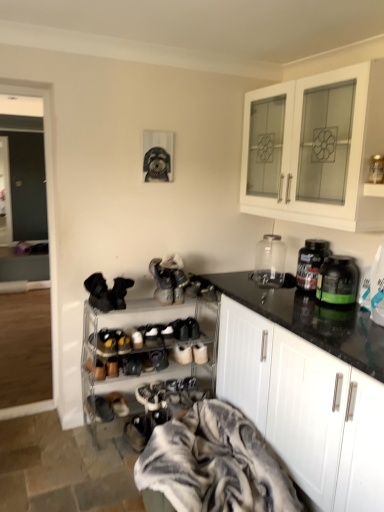
Question: Considering the positions of black suede shoes at lower center, acting as the fifth footwear starting from the top, and black matte shoe at center, which is the second shoe from top to bottom, in the image, is black suede shoes at lower center, acting as the fifth footwear starting from the top, taller or shorter than black matte shoe at center, which is the second shoe from top to bottom,?

Choices:
 (A) tall
 (B) short

Answer: (A)

Question: Is black suede shoes at lower center, acting as the fifth footwear starting from the top, in front of or behind black matte shoe at center, the 5th shoe from the bottom, in the image?

Choices:
 (A) behind
 (B) front

Answer: (B)

Question: Based on their relative distances, which object is nearer to the white matte cabinet at right, the 2th cabinetry positioned from the top?

Choices:
 (A) fluffy gray blanket at lower center
 (B) shiny black shoe at center, positioned as the third shoe in top-to-bottom order
 (C) black suede shoes at center, the 5th footwear from the bottom
 (D) white suede shoe at lower center, which is counted as the first shoe, starting from the bottom
 (E) black suede shoe at lower center, which appears as the second shoe when ordered from the bottom

Answer: (A)

Question: Which object is the farthest from the leather sneaker at lower left, marked as the fifth footwear in a right-to-left arrangement?

Choices:
 (A) black suede shoe at center, which appears as the sixth shoe when ordered from the bottom
 (B) black matte shoe at center, which is the second shoe from top to bottom
 (C) white glossy cabinet at upper right, which appears as the first cabinetry when viewed from the top
 (D) translucent plastic bottle at right, the 2th bottle viewed from the front
 (E) black suede shoe at lower center, which appears as the second shoe when ordered from the bottom

Answer: (C)